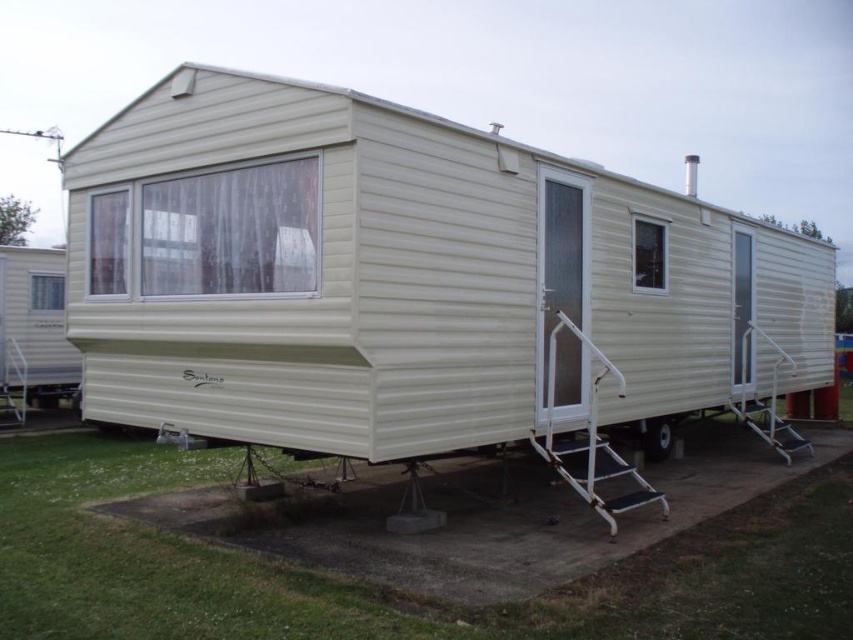
Does white metallic ladder at lower left come behind black rubber wheel at lower right?

That is True.

Where is `white metallic ladder at lower left`? The width and height of the screenshot is (853, 640). white metallic ladder at lower left is located at coordinates (10, 384).

Which is below, beige corrugated metal trailer at center or white metallic ladder at right?

white metallic ladder at right is below.

Can you confirm if beige corrugated metal trailer at center is taller than white metallic ladder at right?

Yes, beige corrugated metal trailer at center is taller than white metallic ladder at right.

Does point (280, 397) come farther from viewer compared to point (784, 353)?

No, (280, 397) is closer to viewer.

In order to click on beige corrugated metal trailer at center in this screenshot , I will do `click(399, 276)`.

Is beige corrugated metal trailer at center taller than white metallic ladder at lower left?

Yes.

Consider the image. Is beige corrugated metal trailer at center to the right of white metallic ladder at lower left from the viewer's perspective?

Yes, beige corrugated metal trailer at center is to the right of white metallic ladder at lower left.

This screenshot has height=640, width=853. What do you see at coordinates (399, 276) in the screenshot?
I see `beige corrugated metal trailer at center` at bounding box center [399, 276].

Where is `beige corrugated metal trailer at center`? beige corrugated metal trailer at center is located at coordinates (399, 276).